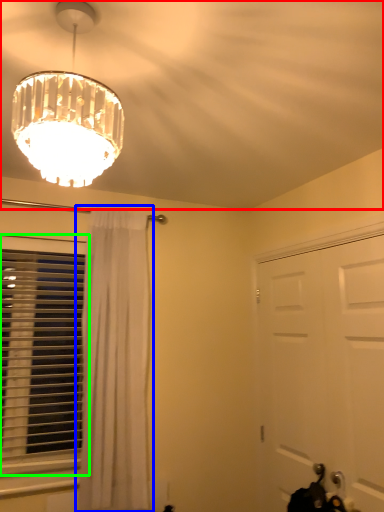
Question: Estimate the real-world distances between objects in this image. Which object is closer to fan (highlighted by a red box), curtain (highlighted by a blue box) or window (highlighted by a green box)?

Choices:
 (A) curtain
 (B) window

Answer: (A)